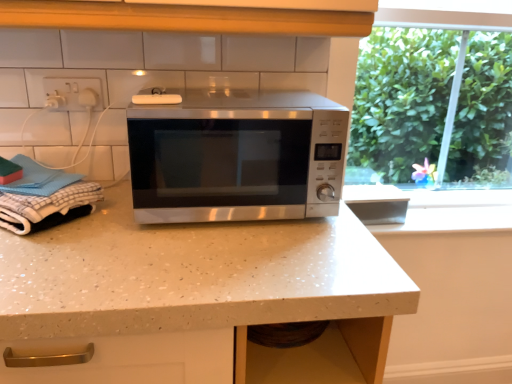
Where is `space that is in front of stainless steel microwave at center`? space that is in front of stainless steel microwave at center is located at coordinates (210, 258).